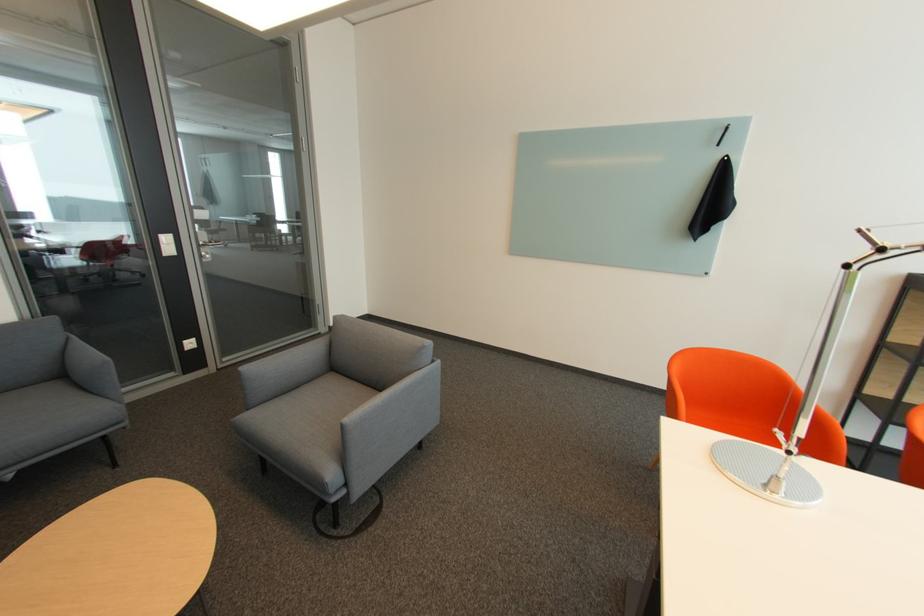
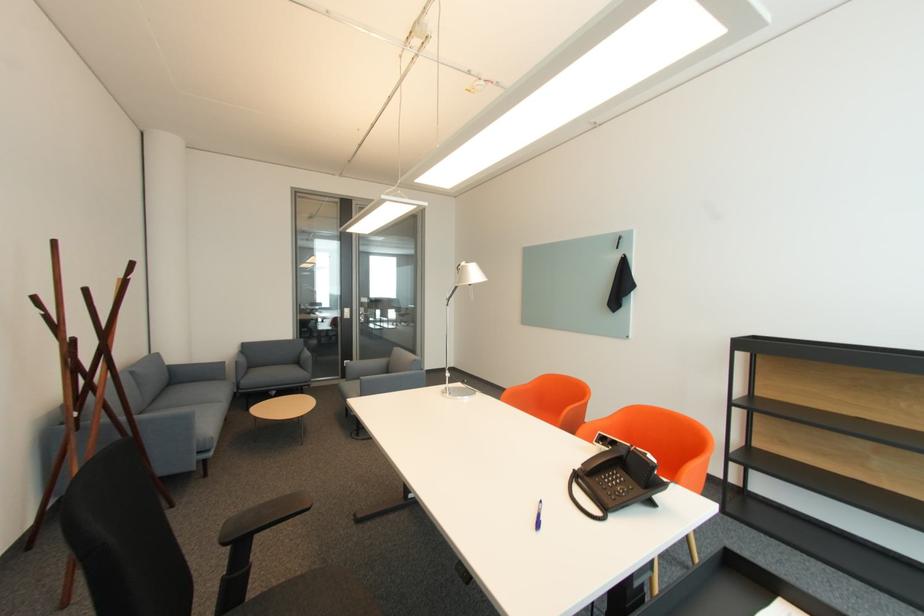
In the second image, find the point that corresponds to pixel 209 257 in the first image.

(367, 320)